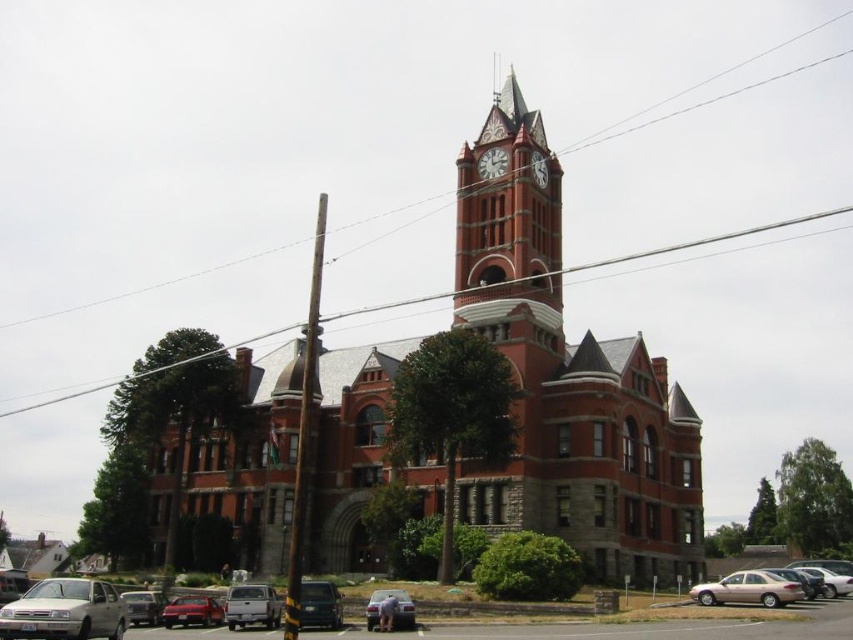
You are standing at the entrance of the historic red brick building and want to park your car. The shiny red sedan at lower left is represented by point (192, 611). Where would you find the shiny red sedan at lower left relative to the building?

The shiny red sedan at lower left is located at point (192, 611) relative to the building.

You are a city planner assessing the space in front of the red brick church at center and the metallic wire at upper center. Which object occupies more horizontal space in the image?

The metallic wire at upper center occupies more horizontal space than the red brick church at center because the red brick church at center has a smaller width.

You are a pedestrian standing on the sidewalk in front of the historic red brick building. You see a smooth gray pole at center and a metallic gray van at lower center. Which object is positioned higher from the ground?

The smooth gray pole at center is located above the metallic gray van at lower center, so it is positioned higher from the ground.